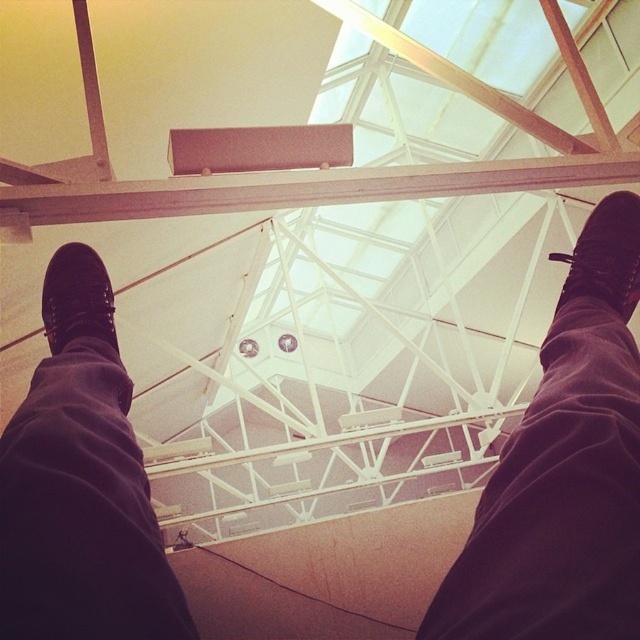
Can you confirm if black suede shoes at upper center is positioned to the left of black leather shoe at left?

In fact, black suede shoes at upper center is to the right of black leather shoe at left.

Does black suede shoes at upper center have a greater width compared to black leather shoe at left?

Correct, the width of black suede shoes at upper center exceeds that of black leather shoe at left.

Is point (582, 308) less distant than point (84, 333)?

Yes, it is in front of point (84, 333).

At what (x,y) coordinates should I click in order to perform the action: click on black suede shoes at upper center. Please return your answer as a coordinate pair (x, y). This screenshot has height=640, width=640. Looking at the image, I should click on (557, 500).

Which is more to the right, black leather shoe at right or black leather shoe at left?

black leather shoe at right

How far apart are black leather shoe at right and black leather shoe at left?

3.95 feet

Is point (624, 278) positioned in front of point (51, 316)?

Yes.

You are a GUI agent. You are given a task and a screenshot of the screen. Output one action in this format:
    pyautogui.click(x=<x>, y=<y>)
    Task: Click on the black leather shoe at right
    
    Given the screenshot: What is the action you would take?
    pyautogui.click(x=605, y=256)

How far apart are black suede shoes at upper center and black leather shoe at right?

The distance of black suede shoes at upper center from black leather shoe at right is 20.05 inches.

Can you confirm if black suede shoes at upper center is smaller than black leather shoe at right?

No, black suede shoes at upper center is not smaller than black leather shoe at right.

You are a GUI agent. You are given a task and a screenshot of the screen. Output one action in this format:
    pyautogui.click(x=<x>, y=<y>)
    Task: Click on the black suede shoes at upper center
    This screenshot has width=640, height=640.
    Given the screenshot: What is the action you would take?
    pos(557,500)

Identify the location of black suede shoes at upper center. Image resolution: width=640 pixels, height=640 pixels. tap(557, 500).